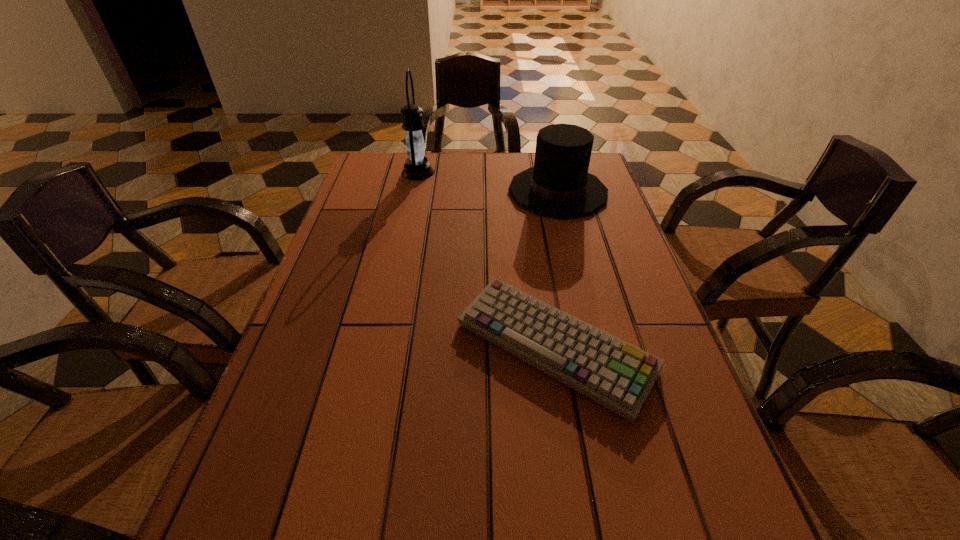
Locate an element on the screen. This screenshot has width=960, height=540. the leftmost object is located at coordinates (417, 167).

At what (x,y) coordinates should I click in order to perform the action: click on lantern. Please return your answer as a coordinate pair (x, y). The image size is (960, 540). Looking at the image, I should click on (417, 167).

I want to click on the second tallest object, so click(x=559, y=185).

Find the location of a particular element. The height and width of the screenshot is (540, 960). the nearest object is located at coordinates (615, 374).

Locate an element on the screen. The height and width of the screenshot is (540, 960). the shortest object is located at coordinates (615, 374).

Image resolution: width=960 pixels, height=540 pixels. What are the coordinates of `vacant region located 0.390m on the side where the tallest object emits light` in the screenshot? It's located at (556, 172).

This screenshot has height=540, width=960. Find the location of `vacant space located 0.140m on the front of the second shortest object with the decoration`. vacant space located 0.140m on the front of the second shortest object with the decoration is located at coordinates (462, 192).

You are a GUI agent. You are given a task and a screenshot of the screen. Output one action in this format:
    pyautogui.click(x=<x>, y=<y>)
    Task: Click on the free region located 0.340m on the front of the second shortest object with the decoration
    
    Given the screenshot: What is the action you would take?
    pyautogui.click(x=396, y=192)

The image size is (960, 540). Find the location of `free space located on the front of the second shortest object with the decoration`. free space located on the front of the second shortest object with the decoration is located at coordinates (402, 192).

At what (x,y) coordinates should I click in order to perform the action: click on vacant area located 0.160m on the back of the computer keyboard. Please return your answer as a coordinate pair (x, y). This screenshot has height=540, width=960. Looking at the image, I should click on (538, 247).